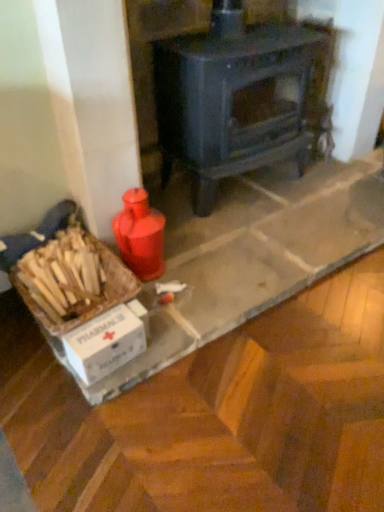
The image size is (384, 512). I want to click on vacant area located to the right-hand side of white cardboard box at lower left, so click(x=187, y=301).